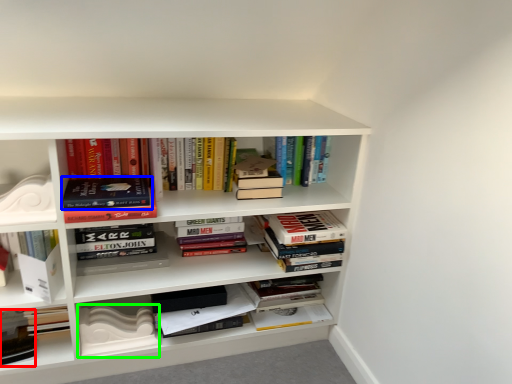
Question: Which object is the farthest from book (highlighted by a red box)? Choose among these: book (highlighted by a blue box) or paperback book (highlighted by a green box).

Choices:
 (A) book
 (B) paperback book

Answer: (A)